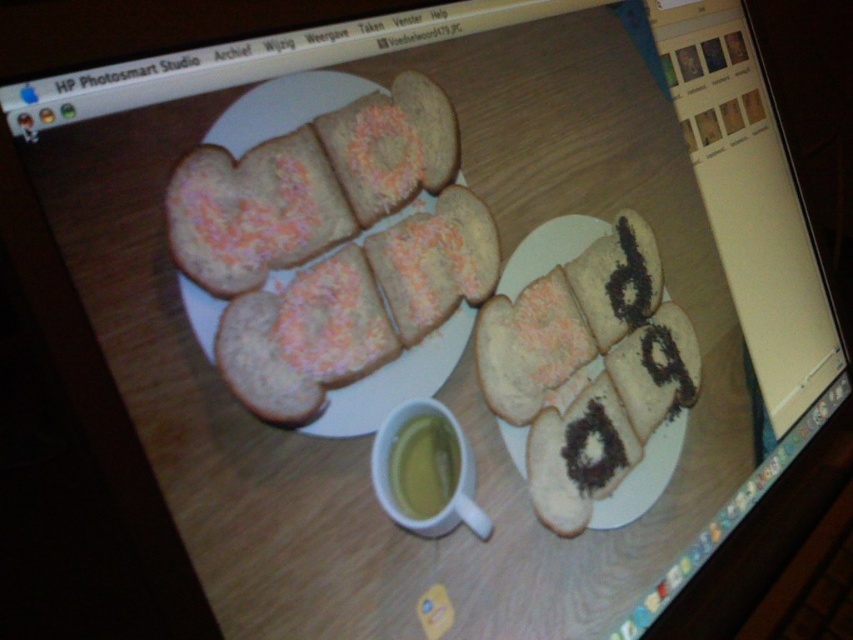
From the picture: Is white frosted cookies at center closer to the viewer compared to yellow translucent cup at center?

Yes, it is in front of yellow translucent cup at center.

Between point (405, 125) and point (445, 486), which one is positioned behind?

Positioned behind is point (405, 125).

The height and width of the screenshot is (640, 853). In order to click on white frosted cookies at center in this screenshot , I will do `click(335, 248)`.

Between chocolate frosted cookies at center and yellow translucent cup at center, which one is positioned higher?

Positioned higher is chocolate frosted cookies at center.

Which of these two, chocolate frosted cookies at center or yellow translucent cup at center, stands shorter?

Standing shorter between the two is yellow translucent cup at center.

Does point (637, 314) come behind point (437, 480)?

Yes, point (637, 314) is behind point (437, 480).

At what (x,y) coordinates should I click in order to perform the action: click on chocolate frosted cookies at center. Please return your answer as a coordinate pair (x, y). Image resolution: width=853 pixels, height=640 pixels. Looking at the image, I should click on (585, 362).

Who is more distant from viewer, (247, 340) or (663, 337)?

Point (663, 337)

At what (x,y) coordinates should I click in order to perform the action: click on white frosted cookies at center. Please return your answer as a coordinate pair (x, y). Looking at the image, I should click on (335, 248).

Is point (389, 316) behind point (624, 314)?

That is False.

You are a GUI agent. You are given a task and a screenshot of the screen. Output one action in this format:
    pyautogui.click(x=<x>, y=<y>)
    Task: Click on the white frosted cookies at center
    
    Given the screenshot: What is the action you would take?
    pyautogui.click(x=335, y=248)